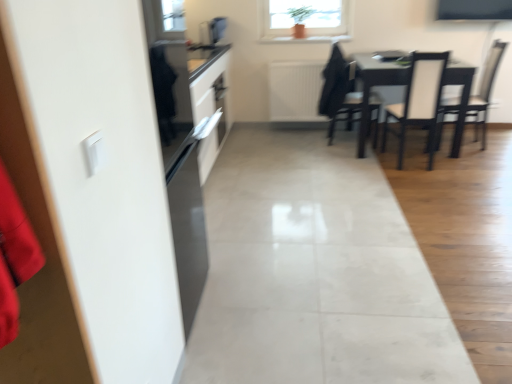
What is the approximate width of dark wood chair at center, arranged as the third chair when viewed from the right?

The width of dark wood chair at center, arranged as the third chair when viewed from the right, is 48.81 centimeters.

The height and width of the screenshot is (384, 512). Find the location of `black matte sweatshirt at upper center`. black matte sweatshirt at upper center is located at coordinates (335, 83).

This screenshot has height=384, width=512. I want to click on white leather chair at right, the 1th chair when ordered from right to left, so coord(485,91).

I want to click on satin black microwave at upper center, so click(x=212, y=31).

The image size is (512, 384). I want to click on dark wood chair at center, arranged as the 1th chair when viewed from the left, so click(339, 91).

Are white textured radiator at center and white leather chair at right, the third chair from the left, far apart?

white textured radiator at center is positioned a significant distance from white leather chair at right, the third chair from the left.

Does white textured radiator at center have a lesser width compared to white leather chair at right, the 1th chair when ordered from right to left?

Correct, the width of white textured radiator at center is less than that of white leather chair at right, the 1th chair when ordered from right to left.

From the image's perspective, is white textured radiator at center positioned above or below white leather chair at right, the third chair from the left?

From the image's perspective, white textured radiator at center appears above white leather chair at right, the third chair from the left.

Which object is closer to the camera, white textured radiator at center or white leather chair at right, the third chair from the left?

Positioned in front is white leather chair at right, the third chair from the left.

Considering the relative sizes of white textured radiator at center and black matte sweatshirt at upper center in the image provided, is white textured radiator at center wider than black matte sweatshirt at upper center?

Incorrect, the width of white textured radiator at center does not surpass that of black matte sweatshirt at upper center.

Is white textured radiator at center far away from black matte sweatshirt at upper center?

white textured radiator at center is near black matte sweatshirt at upper center, not far away.

Does point (315, 61) lie in front of point (324, 99)?

No, (315, 61) is behind (324, 99).

Does white textured radiator at center come behind black matte sweatshirt at upper center?

Yes.

Choose the correct answer: Is dark wood chair at center, arranged as the third chair when viewed from the right, inside white leather chair at center, the second chair positioned from the right, or outside it?

The correct answer is: outside.

From a real-world perspective, who is located lower, dark wood chair at center, arranged as the third chair when viewed from the right, or white leather chair at center, the second chair positioned from the right?

white leather chair at center, the second chair positioned from the right, from a real-world perspective.

Can you confirm if dark wood chair at center, arranged as the 1th chair when viewed from the left, is positioned to the left of white leather chair at center, which is the second chair from left to right?

Indeed, dark wood chair at center, arranged as the 1th chair when viewed from the left, is positioned on the left side of white leather chair at center, which is the second chair from left to right.

Is the depth of dark wood chair at center, arranged as the 1th chair when viewed from the left, greater than that of white leather chair at center, the second chair positioned from the right?

Yes.

Considering the positions of objects black matte sweatshirt at upper center and dark wood chair at center, arranged as the third chair when viewed from the right, in the image provided, who is more to the right, black matte sweatshirt at upper center or dark wood chair at center, arranged as the third chair when viewed from the right,?

dark wood chair at center, arranged as the third chair when viewed from the right, is more to the right.

Who is bigger, black matte sweatshirt at upper center or dark wood chair at center, arranged as the third chair when viewed from the right?

Bigger between the two is dark wood chair at center, arranged as the third chair when viewed from the right.

Considering the positions of point (324, 99) and point (333, 122), is point (324, 99) closer or farther from the camera than point (333, 122)?

Point (324, 99) is farther from the camera than point (333, 122).

Is black matte sweatshirt at upper center positioned with its back to dark wood chair at center, arranged as the 1th chair when viewed from the left?

Absolutely, black matte sweatshirt at upper center is directed away from dark wood chair at center, arranged as the 1th chair when viewed from the left.

From the image's perspective, does white leather chair at center, which is the second chair from left to right, appear lower than black matte sweatshirt at upper center?

Indeed, from the image's perspective, white leather chair at center, which is the second chair from left to right, is shown beneath black matte sweatshirt at upper center.

Is white leather chair at center, which is the second chair from left to right, facing away from black matte sweatshirt at upper center?

white leather chair at center, which is the second chair from left to right, does not have its back to black matte sweatshirt at upper center.

Is white leather chair at center, the second chair positioned from the right, inside the boundaries of black matte sweatshirt at upper center, or outside?

white leather chair at center, the second chair positioned from the right, exists outside the volume of black matte sweatshirt at upper center.

Considering the positions of point (403, 156) and point (337, 79), is point (403, 156) closer or farther from the camera than point (337, 79)?

Point (403, 156) appears to be closer to the viewer than point (337, 79).

What's the angular difference between satin black microwave at upper center and black matte sweatshirt at upper center's facing directions?

1.3 degrees separate the facing orientations of satin black microwave at upper center and black matte sweatshirt at upper center.

From the image's perspective, is satin black microwave at upper center under black matte sweatshirt at upper center?

No, from the image's perspective, satin black microwave at upper center is not beneath black matte sweatshirt at upper center.

Can you confirm if satin black microwave at upper center is thinner than black matte sweatshirt at upper center?

Correct, the width of satin black microwave at upper center is less than that of black matte sweatshirt at upper center.

Would you say satin black microwave at upper center is outside black matte sweatshirt at upper center?

Yes.

There is a white leather chair at right, the 1th chair when ordered from right to left. At what (x,y) coordinates should I click in order to perform the action: click on appliance above it (from a real-world perspective). Please return your answer as a coordinate pair (x, y). Looking at the image, I should click on (212, 31).

Does white leather chair at right, the third chair from the left, turn towards satin black microwave at upper center?

Yes, white leather chair at right, the third chair from the left, is oriented towards satin black microwave at upper center.

From the image's perspective, between white leather chair at right, the third chair from the left, and satin black microwave at upper center, who is located below?

white leather chair at right, the third chair from the left.

Is white leather chair at right, the third chair from the left, in front of or behind satin black microwave at upper center in the image?

In the image, white leather chair at right, the third chair from the left, appears in front of satin black microwave at upper center.

In the image, there is a white leather chair at right, the 1th chair when ordered from right to left. Identify the location of radiator below it (from a real-world perspective). This screenshot has width=512, height=384. (295, 91).

In order to click on radiator behind the black matte sweatshirt at upper center in this screenshot , I will do `click(295, 91)`.

Considering their positions, is dark wood chair at center, arranged as the third chair when viewed from the right, positioned further to black matte sweatshirt at upper center than white textured radiator at center?

Among the two, white textured radiator at center is located further to black matte sweatshirt at upper center.

Based on their spatial positions, is white leather chair at right, the third chair from the left, or white textured radiator at center further from white leather chair at center, which is the second chair from left to right?

white textured radiator at center lies further to white leather chair at center, which is the second chair from left to right, than the other object.

Which object lies further to the anchor point white textured radiator at center, white leather chair at center, which is the second chair from left to right, or satin black microwave at upper center?

white leather chair at center, which is the second chair from left to right, is positioned further to the anchor white textured radiator at center.

Looking at this image, considering their positions, is white textured radiator at center positioned further to white leather chair at right, the third chair from the left, than white leather chair at center, the second chair positioned from the right?

white textured radiator at center.

Consider the image. Considering their positions, is satin black microwave at upper center positioned closer to dark wood chair at center, arranged as the third chair when viewed from the right, than black matte sweatshirt at upper center?

Based on the image, black matte sweatshirt at upper center appears to be nearer to dark wood chair at center, arranged as the third chair when viewed from the right.

Which object lies further to the anchor point black matte sweatshirt at upper center, white leather chair at center, which is the second chair from left to right, or dark wood chair at center, arranged as the third chair when viewed from the right?

Among the two, white leather chair at center, which is the second chair from left to right, is located further to black matte sweatshirt at upper center.

Looking at the image, which one is located further to satin black microwave at upper center, white leather chair at center, the second chair positioned from the right, or dark wood chair at center, arranged as the third chair when viewed from the right?

The object further to satin black microwave at upper center is white leather chair at center, the second chair positioned from the right.

Based on their spatial positions, is white leather chair at right, the third chair from the left, or black matte sweatshirt at upper center closer to satin black microwave at upper center?

black matte sweatshirt at upper center lies closer to satin black microwave at upper center than the other object.

Find the location of a particular element. This screenshot has height=384, width=512. radiator situated between satin black microwave at upper center and white leather chair at right, the 1th chair when ordered from right to left, from left to right is located at coordinates (295, 91).

Find the location of a particular element. Image resolution: width=512 pixels, height=384 pixels. sweatshirt between satin black microwave at upper center and dark wood chair at center, arranged as the third chair when viewed from the right, from left to right is located at coordinates (335, 83).

Identify the location of radiator between satin black microwave at upper center and white leather chair at center, which is the second chair from left to right, from left to right. (295, 91).

Identify the location of chair situated between black matte sweatshirt at upper center and white leather chair at center, the second chair positioned from the right, from left to right. The image size is (512, 384). (339, 91).